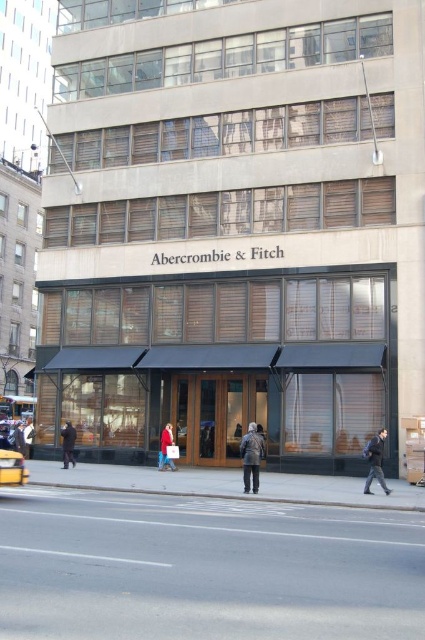
Between dark gray coat at center and red wool coat at lower center, which one appears on the right side from the viewer's perspective?

dark gray coat at center

Is dark gray coat at center shorter than red wool coat at lower center?

Indeed, dark gray coat at center has a lesser height compared to red wool coat at lower center.

Between point (246, 451) and point (172, 442), which one is positioned behind?

The point (172, 442) is behind.

The image size is (425, 640). In order to click on dark gray coat at center in this screenshot , I will do pyautogui.click(x=252, y=456).

Does yellow rubber taxi at lower left appear over dark brown leather coat at lower left?

Indeed, yellow rubber taxi at lower left is positioned over dark brown leather coat at lower left.

Measure the distance between yellow rubber taxi at lower left and camera.

A distance of 13.97 meters exists between yellow rubber taxi at lower left and camera.

Find the location of a particular element. Image resolution: width=425 pixels, height=640 pixels. yellow rubber taxi at lower left is located at coordinates (11, 467).

Who is positioned more to the right, dark gray coat at center or dark gray jacket at lower left?

dark gray coat at center is more to the right.

Is dark gray coat at center in front of dark gray jacket at lower left?

That is True.

Does point (255, 490) come farther from viewer compared to point (13, 436)?

No, it is not.

Where is `dark gray coat at center`? dark gray coat at center is located at coordinates (252, 456).